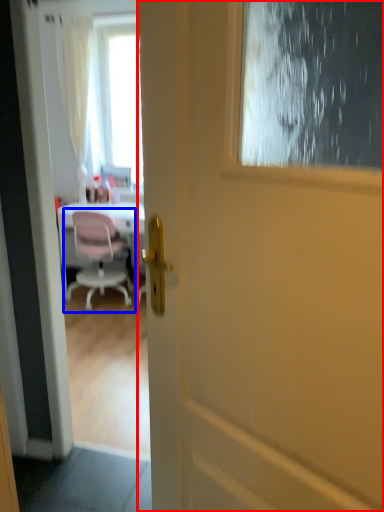
Question: Which point is closer to the camera, door (highlighted by a red box) or chair (highlighted by a blue box)?

Choices:
 (A) door
 (B) chair

Answer: (A)